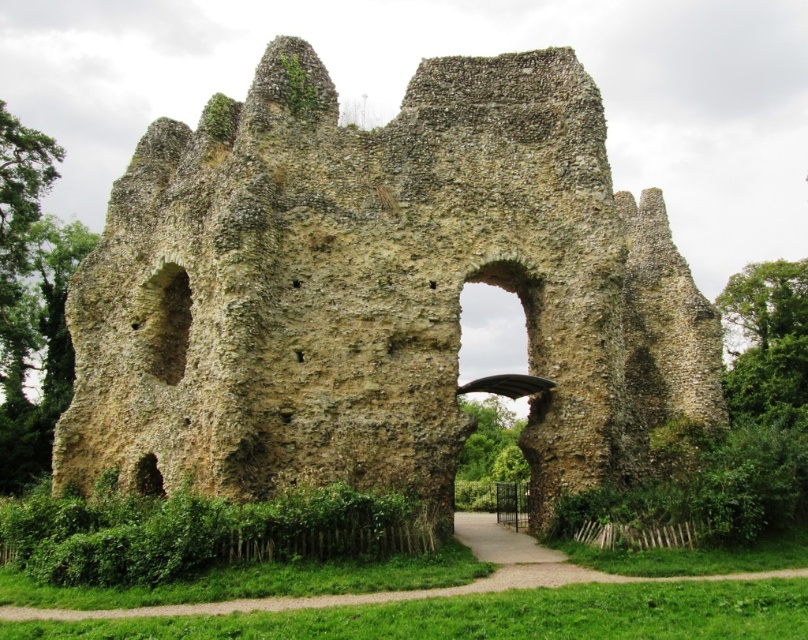
You are an archaeologist examining the medieval ruins. You notice the rustic stone ruins at center and the stone archway at center. Based on their positions, which one is located to the left side of the other?

The rustic stone ruins at center are positioned to the left of the stone archway at center.

You are an architect examining the medieval ruins. You notice the rustic stone ruins at center and the stone archway at center. Which structure is taller?

The rustic stone ruins at center are taller than the stone archway at center.

Looking at this image, you are an archaeologist examining the medieval ruins. You notice the rustic stone ruins at center and the stone archway at center. Which structure has a greater width?

The rustic stone ruins at center might be wider than the stone archway at center, so the rustic stone ruins at center likely has a greater width.